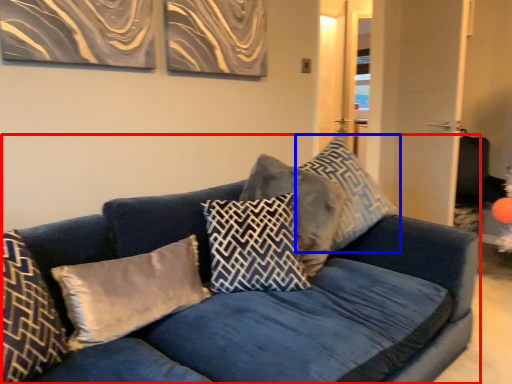
Question: Which object is closer to the camera taking this photo, studio couch (highlighted by a red box) or pillow (highlighted by a blue box)?

Choices:
 (A) studio couch
 (B) pillow

Answer: (A)